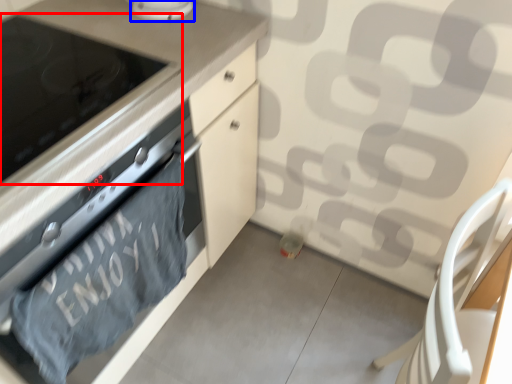
Question: Which object is closer to the camera taking this photo, home appliance (highlighted by a red box) or kitchen appliance (highlighted by a blue box)?

Choices:
 (A) home appliance
 (B) kitchen appliance

Answer: (A)